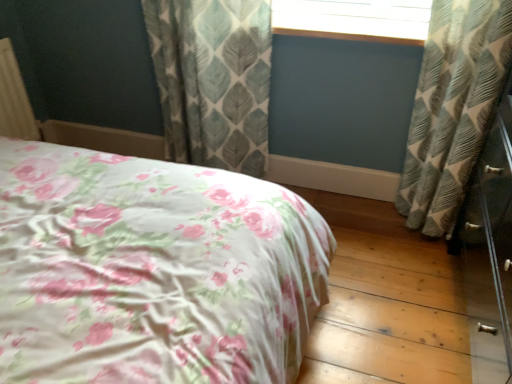
I want to click on floral fabric bed at center, so click(152, 270).

Locate an element on the screen. textured gray-green curtain at right, arranged as the first curtain when viewed from the right is located at coordinates (452, 107).

Find the location of a particular element. The width and height of the screenshot is (512, 384). wooden window frame at upper center is located at coordinates (354, 19).

Does textured gray-green curtain at right, arranged as the second curtain when viewed from the left, contain wooden window frame at upper center?

No, wooden window frame at upper center is not inside textured gray-green curtain at right, arranged as the second curtain when viewed from the left.

Where is `window frame above the textured gray-green curtain at right, arranged as the second curtain when viewed from the left (from the image's perspective)`? window frame above the textured gray-green curtain at right, arranged as the second curtain when viewed from the left (from the image's perspective) is located at coordinates (354, 19).

Is textured gray-green curtain at right, arranged as the second curtain when viewed from the left, far from wooden window frame at upper center?

That's not correct — textured gray-green curtain at right, arranged as the second curtain when viewed from the left, is a little close to wooden window frame at upper center.

In the image, is wooden window frame at upper center positioned in front of or behind floral fabric bed at center?

wooden window frame at upper center is behind floral fabric bed at center.

Based on the photo, considering the relative sizes of wooden window frame at upper center and floral fabric bed at center in the image provided, is wooden window frame at upper center shorter than floral fabric bed at center?

Yes, wooden window frame at upper center is shorter than floral fabric bed at center.

Identify the location of bed that appears in front of the wooden window frame at upper center. This screenshot has width=512, height=384. (152, 270).

Is wooden window frame at upper center not inside textured gray-green leaf-patterned curtain at center, which is the first curtain from left to right?

That's correct, wooden window frame at upper center is outside of textured gray-green leaf-patterned curtain at center, which is the first curtain from left to right.

From the image's perspective, relative to textured gray-green leaf-patterned curtain at center, positioned as the 2th curtain in right-to-left order, is wooden window frame at upper center above or below?

From the image's perspective, wooden window frame at upper center appears above textured gray-green leaf-patterned curtain at center, positioned as the 2th curtain in right-to-left order.

Considering the sizes of objects wooden window frame at upper center and textured gray-green leaf-patterned curtain at center, which is the first curtain from left to right, in the image provided, who is shorter, wooden window frame at upper center or textured gray-green leaf-patterned curtain at center, which is the first curtain from left to right,?

With less height is wooden window frame at upper center.

Considering the positions of points (292, 32) and (270, 1), is point (292, 32) closer to camera compared to point (270, 1)?

No, it is behind (270, 1).

In the scene shown: Is textured gray-green leaf-patterned curtain at center, positioned as the 2th curtain in right-to-left order, far away from floral fabric bed at center?

That's not correct — textured gray-green leaf-patterned curtain at center, positioned as the 2th curtain in right-to-left order, is a little close to floral fabric bed at center.

From a real-world perspective, between textured gray-green leaf-patterned curtain at center, positioned as the 2th curtain in right-to-left order, and floral fabric bed at center, who is vertically higher?

floral fabric bed at center is physically above.

Does point (243, 149) come closer to viewer compared to point (304, 312)?

No, it is not.

Could you measure the distance between textured gray-green leaf-patterned curtain at center, which is the first curtain from left to right, and floral fabric bed at center?

textured gray-green leaf-patterned curtain at center, which is the first curtain from left to right, and floral fabric bed at center are 31.90 inches apart from each other.

From the image's perspective, between floral fabric bed at center and textured gray-green curtain at right, arranged as the first curtain when viewed from the right, which one is located above?

textured gray-green curtain at right, arranged as the first curtain when viewed from the right, is shown above in the image.

Does floral fabric bed at center contain textured gray-green curtain at right, arranged as the second curtain when viewed from the left?

Definitely not — textured gray-green curtain at right, arranged as the second curtain when viewed from the left, is not inside floral fabric bed at center.

Between point (242, 360) and point (453, 24), which one is positioned behind?

The point (453, 24) is behind.

Which object is thinner, floral fabric bed at center or textured gray-green curtain at right, arranged as the second curtain when viewed from the left?

textured gray-green curtain at right, arranged as the second curtain when viewed from the left.

Which of these two, textured gray-green curtain at right, arranged as the second curtain when viewed from the left, or floral fabric bed at center, is thinner?

textured gray-green curtain at right, arranged as the second curtain when viewed from the left, is thinner.

Looking at the image, does textured gray-green curtain at right, arranged as the first curtain when viewed from the right, seem bigger or smaller compared to floral fabric bed at center?

In the image, textured gray-green curtain at right, arranged as the first curtain when viewed from the right, appears to be smaller than floral fabric bed at center.

Considering the relative positions of textured gray-green curtain at right, arranged as the second curtain when viewed from the left, and floral fabric bed at center in the image provided, is textured gray-green curtain at right, arranged as the second curtain when viewed from the left, to the left of floral fabric bed at center from the viewer's perspective?

No, textured gray-green curtain at right, arranged as the second curtain when viewed from the left, is not to the left of floral fabric bed at center.

Is textured gray-green curtain at right, arranged as the first curtain when viewed from the right, in front of or behind floral fabric bed at center in the image?

Clearly, textured gray-green curtain at right, arranged as the first curtain when viewed from the right, is behind floral fabric bed at center.

How different are the orientations of textured gray-green leaf-patterned curtain at center, which is the first curtain from left to right, and textured gray-green curtain at right, arranged as the second curtain when viewed from the left, in degrees?

textured gray-green leaf-patterned curtain at center, which is the first curtain from left to right, and textured gray-green curtain at right, arranged as the second curtain when viewed from the left, are facing 0.00141 degrees away from each other.

From the image's perspective, would you say textured gray-green leaf-patterned curtain at center, which is the first curtain from left to right, is shown under textured gray-green curtain at right, arranged as the first curtain when viewed from the right?

Actually, textured gray-green leaf-patterned curtain at center, which is the first curtain from left to right, appears above textured gray-green curtain at right, arranged as the first curtain when viewed from the right, in the image.

Considering the relative sizes of textured gray-green leaf-patterned curtain at center, which is the first curtain from left to right, and textured gray-green curtain at right, arranged as the first curtain when viewed from the right, in the image provided, is textured gray-green leaf-patterned curtain at center, which is the first curtain from left to right, shorter than textured gray-green curtain at right, arranged as the first curtain when viewed from the right,?

Yes, textured gray-green leaf-patterned curtain at center, which is the first curtain from left to right, is shorter than textured gray-green curtain at right, arranged as the first curtain when viewed from the right.

Can you confirm if textured gray-green leaf-patterned curtain at center, which is the first curtain from left to right, is smaller than textured gray-green curtain at right, arranged as the second curtain when viewed from the left?

Indeed, textured gray-green leaf-patterned curtain at center, which is the first curtain from left to right, has a smaller size compared to textured gray-green curtain at right, arranged as the second curtain when viewed from the left.

Locate an element on the screen. This screenshot has width=512, height=384. window frame above the textured gray-green curtain at right, arranged as the first curtain when viewed from the right (from a real-world perspective) is located at coordinates (354, 19).

I want to click on bed on the left of wooden window frame at upper center, so click(152, 270).

Looking at the image, which one is located further to textured gray-green leaf-patterned curtain at center, positioned as the 2th curtain in right-to-left order, textured gray-green curtain at right, arranged as the second curtain when viewed from the left, or wooden window frame at upper center?

Among the two, textured gray-green curtain at right, arranged as the second curtain when viewed from the left, is located further to textured gray-green leaf-patterned curtain at center, positioned as the 2th curtain in right-to-left order.

Based on their spatial positions, is textured gray-green curtain at right, arranged as the second curtain when viewed from the left, or wooden window frame at upper center further from floral fabric bed at center?

wooden window frame at upper center.

Which object lies further to the anchor point textured gray-green curtain at right, arranged as the second curtain when viewed from the left, wooden window frame at upper center or textured gray-green leaf-patterned curtain at center, which is the first curtain from left to right?

textured gray-green leaf-patterned curtain at center, which is the first curtain from left to right, lies further to textured gray-green curtain at right, arranged as the second curtain when viewed from the left, than the other object.

Which object lies further to the anchor point floral fabric bed at center, textured gray-green curtain at right, arranged as the second curtain when viewed from the left, or textured gray-green leaf-patterned curtain at center, positioned as the 2th curtain in right-to-left order?

textured gray-green curtain at right, arranged as the second curtain when viewed from the left, is positioned further to the anchor floral fabric bed at center.

Based on their spatial positions, is textured gray-green leaf-patterned curtain at center, positioned as the 2th curtain in right-to-left order, or wooden window frame at upper center further from textured gray-green curtain at right, arranged as the first curtain when viewed from the right?

textured gray-green leaf-patterned curtain at center, positioned as the 2th curtain in right-to-left order, is positioned further to the anchor textured gray-green curtain at right, arranged as the first curtain when viewed from the right.

Which object lies nearer to the anchor point wooden window frame at upper center, floral fabric bed at center or textured gray-green leaf-patterned curtain at center, which is the first curtain from left to right?

textured gray-green leaf-patterned curtain at center, which is the first curtain from left to right, lies closer to wooden window frame at upper center than the other object.

Considering their positions, is textured gray-green leaf-patterned curtain at center, which is the first curtain from left to right, positioned further to wooden window frame at upper center than textured gray-green curtain at right, arranged as the first curtain when viewed from the right?

The object further to wooden window frame at upper center is textured gray-green leaf-patterned curtain at center, which is the first curtain from left to right.

Based on their spatial positions, is textured gray-green leaf-patterned curtain at center, positioned as the 2th curtain in right-to-left order, or wooden window frame at upper center closer to floral fabric bed at center?

textured gray-green leaf-patterned curtain at center, positioned as the 2th curtain in right-to-left order, is positioned closer to the anchor floral fabric bed at center.

Find the location of a particular element. window frame situated between floral fabric bed at center and textured gray-green curtain at right, arranged as the first curtain when viewed from the right, from left to right is located at coordinates (354, 19).

In order to click on window frame located between textured gray-green leaf-patterned curtain at center, which is the first curtain from left to right, and textured gray-green curtain at right, arranged as the second curtain when viewed from the left, in the left-right direction in this screenshot , I will do `click(354, 19)`.

Image resolution: width=512 pixels, height=384 pixels. What are the coordinates of `curtain situated between floral fabric bed at center and textured gray-green curtain at right, arranged as the second curtain when viewed from the left, from left to right` in the screenshot? It's located at coord(213,80).